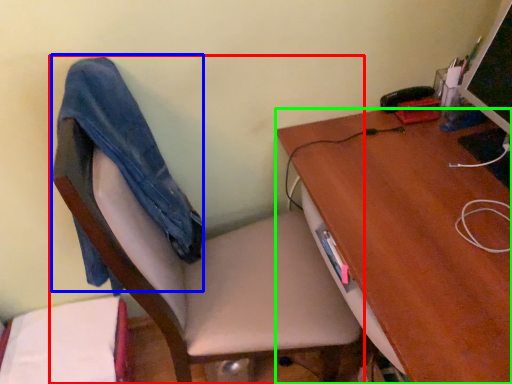
Question: Which object is the closest to the chair (highlighted by a red box)? Choose among these: jeans (highlighted by a blue box) or desk (highlighted by a green box).

Choices:
 (A) jeans
 (B) desk

Answer: (A)